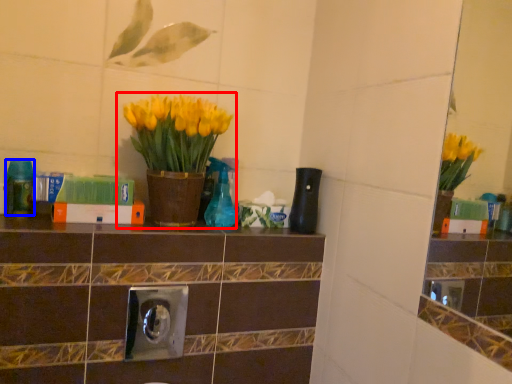
Question: Among these objects, which one is farthest to the camera, houseplant (highlighted by a red box) or bottle (highlighted by a blue box)?

Choices:
 (A) houseplant
 (B) bottle

Answer: (B)